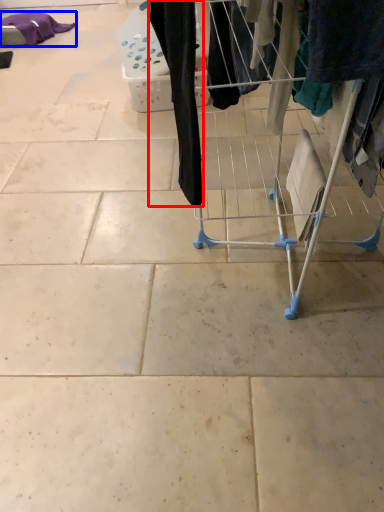
Question: Which object appears farthest to the camera in this image, clothing (highlighted by a red box) or clothing (highlighted by a blue box)?

Choices:
 (A) clothing
 (B) clothing

Answer: (B)